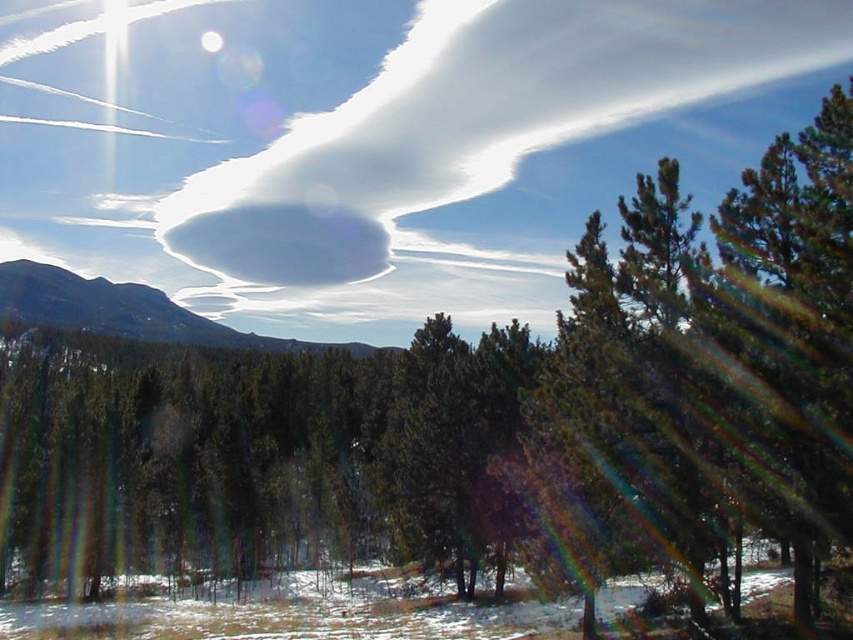
Is white fluffy cloud at upper center bigger than smooth gray rock at upper left?

Yes, white fluffy cloud at upper center is bigger than smooth gray rock at upper left.

What do you see at coordinates (476, 120) in the screenshot? This screenshot has width=853, height=640. I see `white fluffy cloud at upper center` at bounding box center [476, 120].

Where is `white fluffy cloud at upper center`? This screenshot has width=853, height=640. white fluffy cloud at upper center is located at coordinates (476, 120).